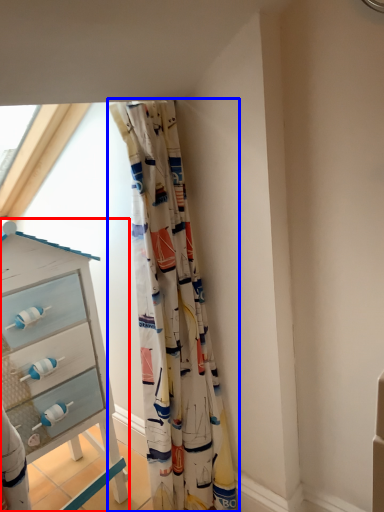
Question: Which of the following is the farthest to the observer, chest of drawers (highlighted by a red box) or curtain (highlighted by a blue box)?

Choices:
 (A) chest of drawers
 (B) curtain

Answer: (A)